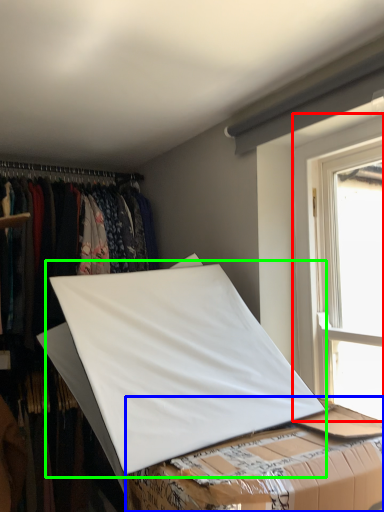
Question: Estimate the real-world distances between objects in this image. Which object is closer to window (highlighted by a red box), table (highlighted by a blue box) or linen (highlighted by a green box)?

Choices:
 (A) table
 (B) linen

Answer: (B)